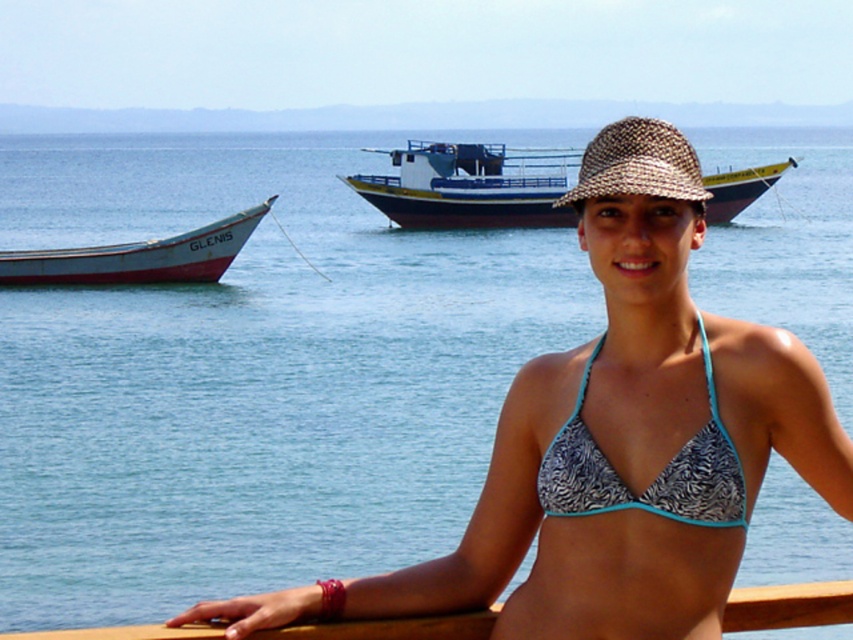
Locate an element on the screen. printed fabric bikini top at center is located at coordinates (654, 477).

Who is shorter, printed fabric bikini top at center or woven straw hat at center?

Standing shorter between the two is printed fabric bikini top at center.

This screenshot has width=853, height=640. What do you see at coordinates (654, 477) in the screenshot?
I see `printed fabric bikini top at center` at bounding box center [654, 477].

Locate an element on the screen. The image size is (853, 640). printed fabric bikini top at center is located at coordinates (654, 477).

Is printed fabric bikini top at center to the right of white wooden boat at left from the viewer's perspective?

Indeed, printed fabric bikini top at center is positioned on the right side of white wooden boat at left.

Does printed fabric bikini top at center have a smaller size compared to white wooden boat at left?

Indeed, printed fabric bikini top at center has a smaller size compared to white wooden boat at left.

Who is more distant from viewer, (616,483) or (126,259)?

Point (126,259)

Locate an element on the screen. printed fabric bikini top at center is located at coordinates (654, 477).

Is white wooden boat at left shorter than woven straw hat at center?

Indeed, white wooden boat at left has a lesser height compared to woven straw hat at center.

Which is below, white wooden boat at left or woven straw hat at center?

Positioned lower is white wooden boat at left.

Who is more forward, (97, 284) or (670, 164)?

Point (670, 164) is in front.

This screenshot has width=853, height=640. I want to click on white wooden boat at left, so click(138, 257).